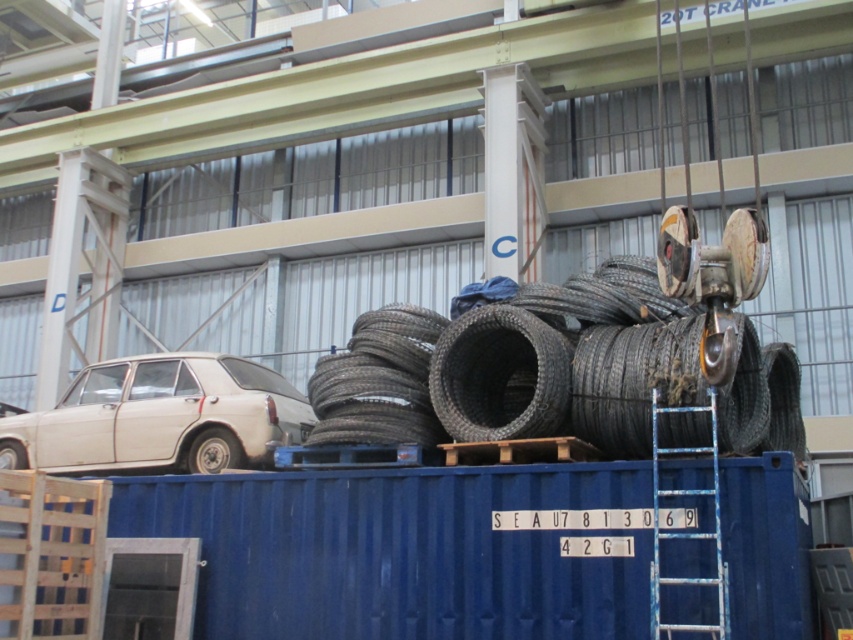
You are a worker in the warehouse. You need to move the black rubber tire at lower left to the other side of the blue metallic ladder at right. Can you do this without moving the ladder?

The blue metallic ladder at right is to the right of the black rubber tire at lower left, so you can move the black rubber tire at lower left to the other side of the blue metallic ladder at right by moving it to the left side of the ladder.

You are standing at the entrance of the warehouse and want to locate the white matte car at left. According to the coordinates, where would you find it?

The white matte car at left is located at coordinates point (160, 417).